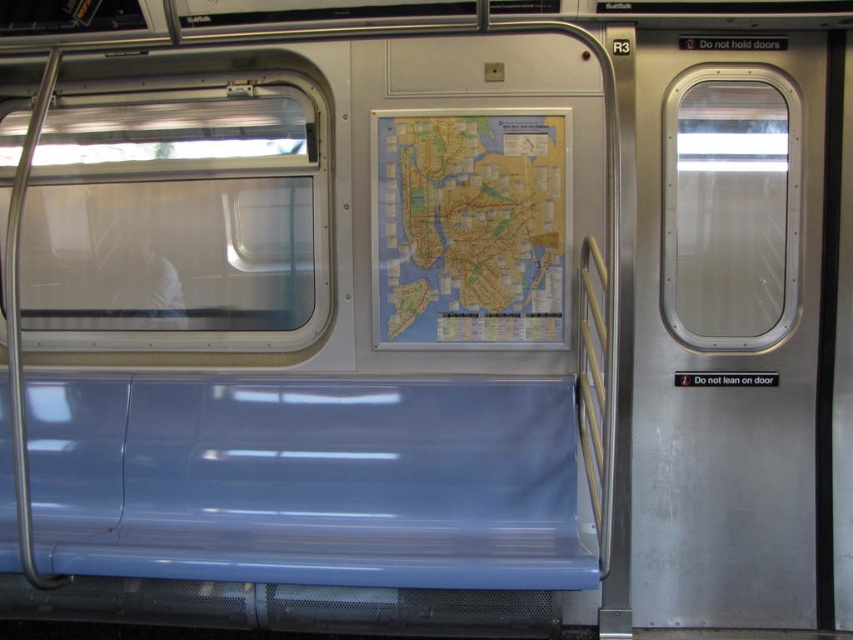
Question: Among these points, which one is farthest from the camera?

Choices:
 (A) (637, 401)
 (B) (386, 179)

Answer: (B)

Question: In this image, where is stainless steel door at right located relative to map at center?

Choices:
 (A) below
 (B) above

Answer: (A)

Question: Among these points, which one is nearest to the camera?

Choices:
 (A) (689, 90)
 (B) (480, 186)

Answer: (A)

Question: Is stainless steel door at right below map at center?

Choices:
 (A) no
 (B) yes

Answer: (B)

Question: Can you confirm if stainless steel door at right is positioned below map at center?

Choices:
 (A) no
 (B) yes

Answer: (B)